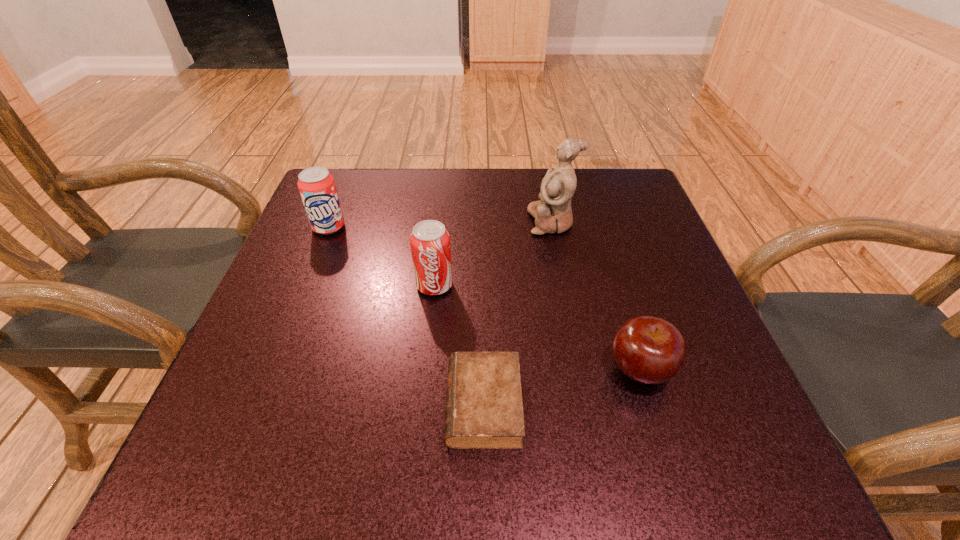
Locate an element on the screen. The height and width of the screenshot is (540, 960). vacant space that satisfies the following two spatial constraints: 1. on the surface of the apple; 2. on the left side of the farther soda can is located at coordinates (272, 370).

The width and height of the screenshot is (960, 540). I want to click on blank area in the image that satisfies the following two spatial constraints: 1. on the logo side of the nearer soda can; 2. on the right side of the fourth tallest object, so click(x=425, y=370).

Identify the location of free location that satisfies the following two spatial constraints: 1. on the front-facing side of the figurine; 2. on the logo side of the third farthest object. (564, 285).

Where is `vacant space that satisfies the following two spatial constraints: 1. on the surface of the leftmost object; 2. on the left side of the fourth tallest object`? The height and width of the screenshot is (540, 960). vacant space that satisfies the following two spatial constraints: 1. on the surface of the leftmost object; 2. on the left side of the fourth tallest object is located at coordinates (272, 370).

Identify the location of vacant point that satisfies the following two spatial constraints: 1. on the front-facing side of the figurine; 2. on the surface of the farther soda can. (553, 227).

Where is `vacant position in the image that satisfies the following two spatial constraints: 1. on the surface of the left soda can; 2. on the right side of the apple`? Image resolution: width=960 pixels, height=540 pixels. vacant position in the image that satisfies the following two spatial constraints: 1. on the surface of the left soda can; 2. on the right side of the apple is located at coordinates (272, 370).

Find the location of `free region that satisfies the following two spatial constraints: 1. on the front-facing side of the tallest object; 2. on the surface of the farther soda can`. free region that satisfies the following two spatial constraints: 1. on the front-facing side of the tallest object; 2. on the surface of the farther soda can is located at coordinates (553, 227).

At what (x,y) coordinates should I click in order to perform the action: click on vacant space that satisfies the following two spatial constraints: 1. on the front-facing side of the tallest object; 2. on the logo side of the nearer soda can. Please return your answer as a coordinate pair (x, y). This screenshot has width=960, height=540. Looking at the image, I should click on (564, 285).